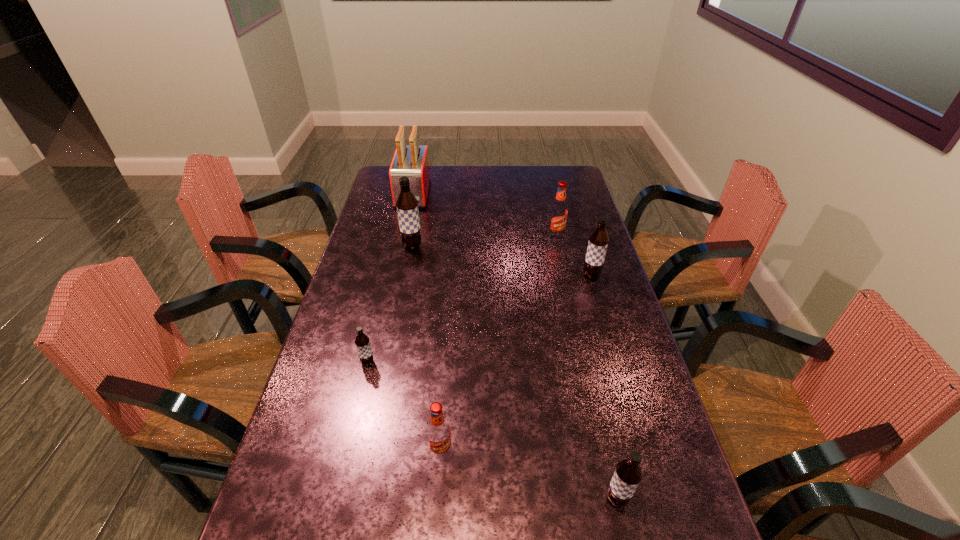
Locate an element on the screen. vacant space that's between the toaster and the third nearest object is located at coordinates (390, 279).

Locate an element on the screen. The image size is (960, 540). vacant space in between the sixth farthest object and the nearest root beer is located at coordinates (529, 475).

Identify the location of free space that is in between the rightmost brown root beer and the third nearest root beer. The width and height of the screenshot is (960, 540). (480, 319).

Locate an element on the screen. This screenshot has height=540, width=960. unoccupied area between the nearer red root beer and the shortest root beer is located at coordinates (404, 407).

Locate an element on the screen. unoccupied area between the fourth nearest root beer and the nearest object is located at coordinates (604, 387).

Find the location of a particular element. This screenshot has width=960, height=540. object that can be found as the closest to the nearer red root beer is located at coordinates (362, 342).

Where is `the third closest object to the rightmost root beer`? The width and height of the screenshot is (960, 540). the third closest object to the rightmost root beer is located at coordinates (412, 161).

Find the location of a particular element. This screenshot has width=960, height=540. root beer identified as the fourth closest to the fifth farthest root beer is located at coordinates (407, 205).

You are a GUI agent. You are given a task and a screenshot of the screen. Output one action in this format:
    pyautogui.click(x=<x>, y=<y>)
    Task: Click on the third closest root beer relative to the farther red root beer
    The height and width of the screenshot is (540, 960).
    Given the screenshot: What is the action you would take?
    pyautogui.click(x=362, y=342)

Find the location of `brown root beer that can be found as the fourth closest to the fourth object from right to left`. brown root beer that can be found as the fourth closest to the fourth object from right to left is located at coordinates (407, 205).